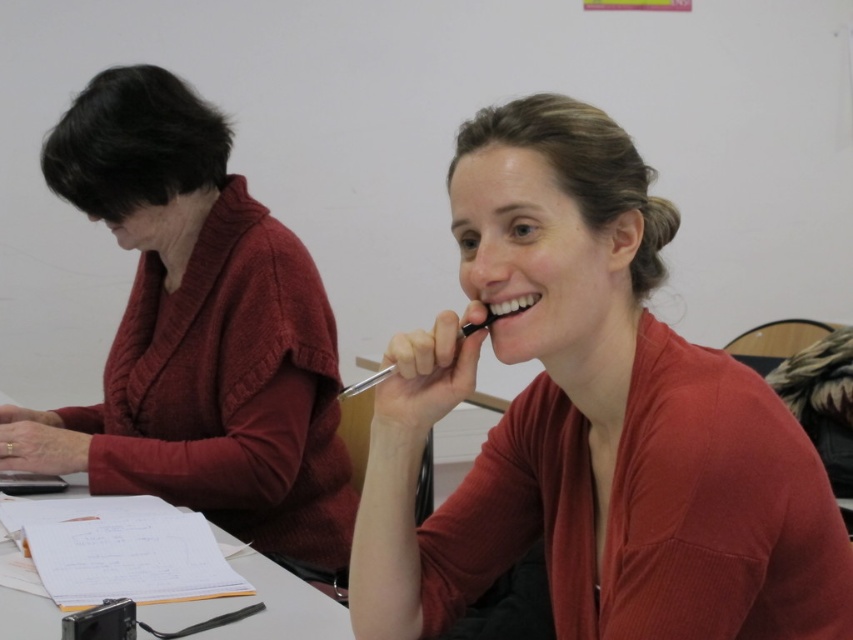
Who is taller, matte red sweater at center or matte red sweater at left?

Standing taller between the two is matte red sweater at left.

Who is positioned more to the left, matte red sweater at center or matte red sweater at left?

matte red sweater at left is more to the left.

Which is behind, point (584, 561) or point (265, 400)?

The point (265, 400) is behind.

You are a GUI agent. You are given a task and a screenshot of the screen. Output one action in this format:
    pyautogui.click(x=<x>, y=<y>)
    Task: Click on the matte red sweater at center
    The image size is (853, 640).
    Given the screenshot: What is the action you would take?
    pyautogui.click(x=590, y=420)

Is matte red sweater at left wider than white paper at center?

Yes, matte red sweater at left is wider than white paper at center.

What do you see at coordinates (196, 332) in the screenshot?
I see `matte red sweater at left` at bounding box center [196, 332].

Is point (148, 394) in front of point (274, 634)?

No.

The image size is (853, 640). In order to click on matte red sweater at left in this screenshot , I will do `click(196, 332)`.

Is matte red sweater at center above white paper at center?

Correct, matte red sweater at center is located above white paper at center.

Which of these two, matte red sweater at center or white paper at center, stands taller?

matte red sweater at center

Describe the element at coordinates (590, 420) in the screenshot. I see `matte red sweater at center` at that location.

Where is `matte red sweater at center`? This screenshot has width=853, height=640. matte red sweater at center is located at coordinates (590, 420).